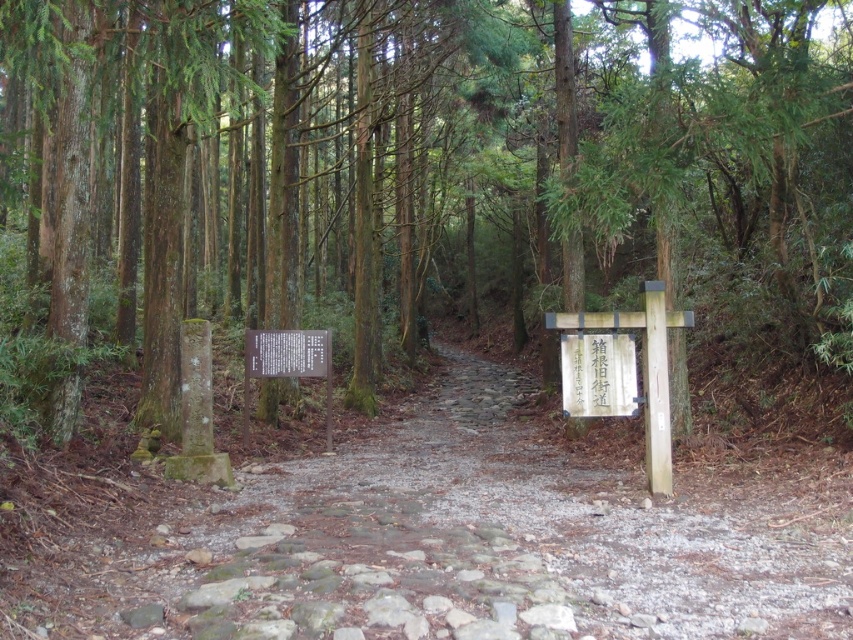
Is green mossy trees at center shorter than stone paved path at center?

No.

Who is more distant from viewer, [788,26] or [672,509]?

The point [788,26] is more distant.

Where is `green mossy trees at center`? green mossy trees at center is located at coordinates (405, 147).

This screenshot has height=640, width=853. I want to click on green mossy trees at center, so click(405, 147).

Is point (170, 33) less distant than point (616, 348)?

Yes, point (170, 33) is in front of point (616, 348).

What are the coordinates of `green mossy trees at center` in the screenshot? It's located at (x=405, y=147).

Does stone paved path at center appear on the right side of white wooden sign at center-right?

No, stone paved path at center is not to the right of white wooden sign at center-right.

Is stone paved path at center to the left of white wooden sign at center-right from the viewer's perspective?

Indeed, stone paved path at center is positioned on the left side of white wooden sign at center-right.

This screenshot has width=853, height=640. I want to click on stone paved path at center, so click(x=459, y=545).

At what (x,y) coordinates should I click in order to perform the action: click on stone paved path at center. Please return your answer as a coordinate pair (x, y). The image size is (853, 640). Looking at the image, I should click on (459, 545).